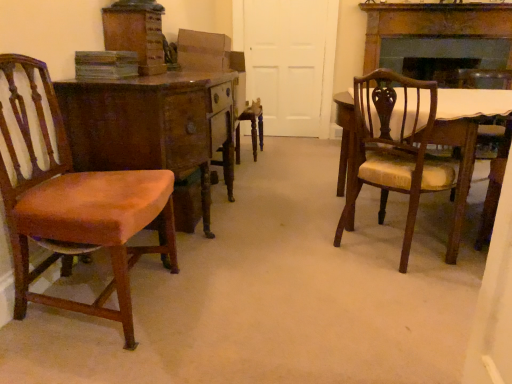
Locate an element on the screen. This screenshot has height=384, width=512. vacant space that is in between matte brown chair at left, which appears as the 2th chair when viewed from the right, and wooden desk at left is located at coordinates (177, 296).